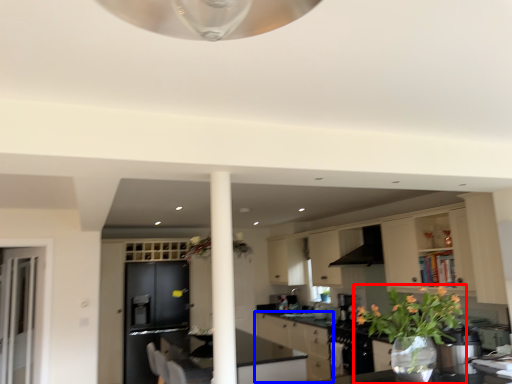
Question: Which object is closer to the camera taking this photo, houseplant (highlighted by a red box) or cabinetry (highlighted by a blue box)?

Choices:
 (A) houseplant
 (B) cabinetry

Answer: (A)